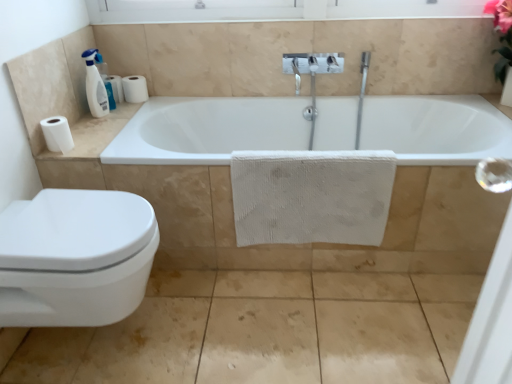
Locate an element on the screen. The width and height of the screenshot is (512, 384). empty space that is ontop of matte beige tile at lower left (from a real-world perspective) is located at coordinates (283, 319).